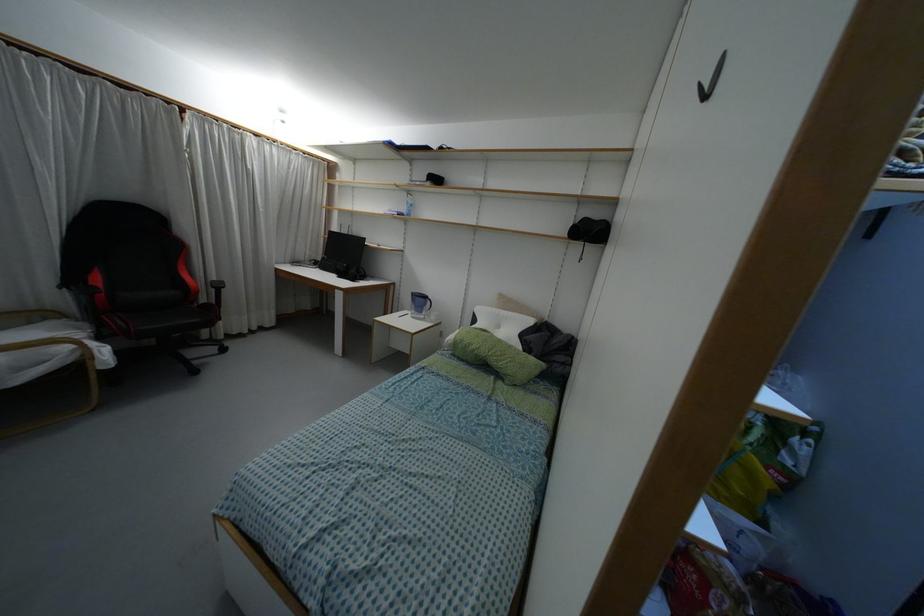
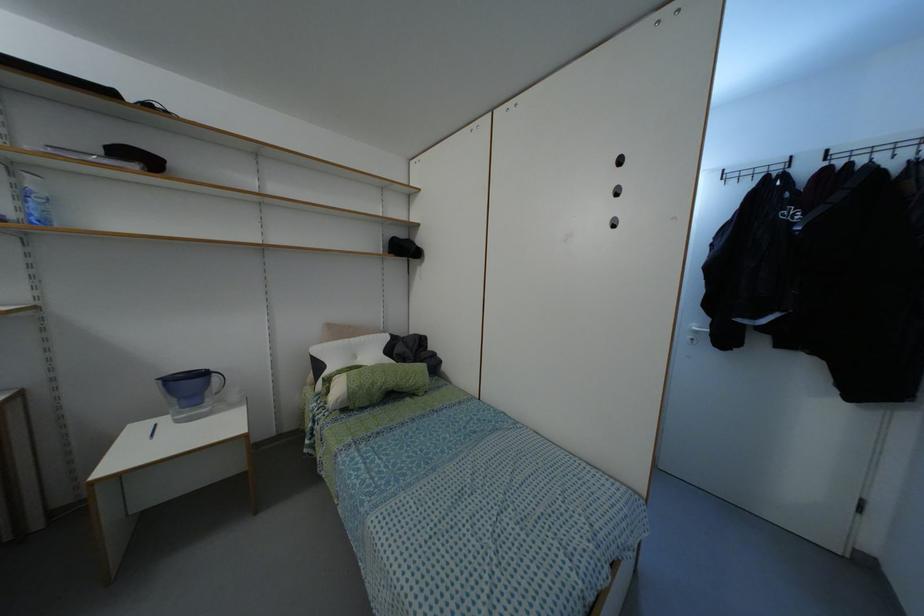
Where in the second image is the point corresponding to the point at 407,215 from the first image?

(44, 222)